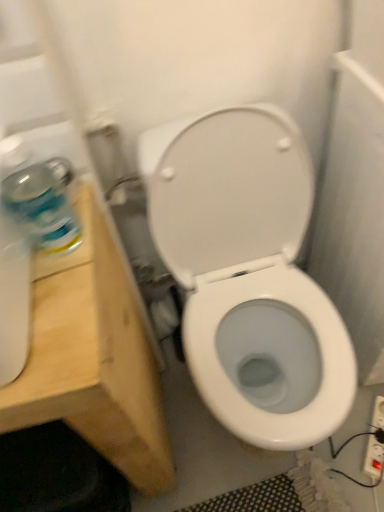
What do you see at coordinates (93, 358) in the screenshot? I see `light wood vanity at left` at bounding box center [93, 358].

The width and height of the screenshot is (384, 512). Identify the location of light wood vanity at left. (93, 358).

What do you see at coordinates (374, 458) in the screenshot? I see `white plastic electrical outlet at lower right` at bounding box center [374, 458].

Locate an element on the screen. This screenshot has width=384, height=512. light wood vanity at left is located at coordinates (93, 358).

Is light wood vanity at left positioned beyond the bounds of white plastic electrical outlet at lower right?

That's correct, light wood vanity at left is outside of white plastic electrical outlet at lower right.

Does light wood vanity at left have a lesser height compared to white plastic electrical outlet at lower right?

Incorrect, the height of light wood vanity at left does not fall short of that of white plastic electrical outlet at lower right.

From a real-world perspective, which is physically below, light wood vanity at left or white plastic electrical outlet at lower right?

From a 3D spatial view, white plastic electrical outlet at lower right is below.

Would you consider light wood vanity at left to be distant from white plastic electrical outlet at lower right?

light wood vanity at left is near white plastic electrical outlet at lower right, not far away.

Would you consider white plastic electrical outlet at lower right to be distant from clear plastic bottle at left?

No, there isn't a large distance between white plastic electrical outlet at lower right and clear plastic bottle at left.

Does point (378, 446) come farther from viewer compared to point (5, 184)?

That is True.

Looking at this image, is white plastic electrical outlet at lower right looking in the opposite direction of clear plastic bottle at left?

white plastic electrical outlet at lower right does not have its back to clear plastic bottle at left.

From a real-world perspective, which object rests below the other?

white plastic electrical outlet at lower right.

Is there a large distance between clear plastic bottle at left and light wood vanity at left?

No, there isn't a large distance between clear plastic bottle at left and light wood vanity at left.

From a real-world perspective, is clear plastic bottle at left above or below light wood vanity at left?

clear plastic bottle at left is above light wood vanity at left.

The width and height of the screenshot is (384, 512). In the image, there is a clear plastic bottle at left. Find the location of `vanity below it (from a real-world perspective)`. vanity below it (from a real-world perspective) is located at coordinates (93, 358).

Who is smaller, light wood vanity at left or clear plastic bottle at left?

Smaller between the two is clear plastic bottle at left.

Can you confirm if light wood vanity at left is positioned to the right of clear plastic bottle at left?

No.

Is light wood vanity at left facing away from clear plastic bottle at left?

No, light wood vanity at left's orientation is not away from clear plastic bottle at left.

Is clear plastic bottle at left located within white glossy toilet at center?

Actually, clear plastic bottle at left is outside white glossy toilet at center.

At what (x,y) coordinates should I click in order to perform the action: click on toilet behind the clear plastic bottle at left. Please return your answer as a coordinate pair (x, y). The image size is (384, 512). Looking at the image, I should click on (246, 261).

How many degrees apart are the facing directions of white glossy toilet at center and clear plastic bottle at left?

The facing directions of white glossy toilet at center and clear plastic bottle at left are 3.16 degrees apart.

From a real-world perspective, who is located higher, white glossy toilet at center or clear plastic bottle at left?

clear plastic bottle at left is physically above.

Is clear plastic bottle at left oriented towards white glossy toilet at center?

No, clear plastic bottle at left is not oriented towards white glossy toilet at center.

Which of these two, clear plastic bottle at left or white glossy toilet at center, is smaller?

clear plastic bottle at left.

Looking at their sizes, would you say clear plastic bottle at left is wider or thinner than white glossy toilet at center?

Clearly, clear plastic bottle at left has less width compared to white glossy toilet at center.

Which is farther, (59, 234) or (193, 304)?

The point (193, 304) is farther.

Is white glossy toilet at center not near white plastic electrical outlet at lower right?

They are positioned close to each other.

Between white glossy toilet at center and white plastic electrical outlet at lower right, which one has smaller size?

white plastic electrical outlet at lower right.

Is white glossy toilet at center oriented away from white plastic electrical outlet at lower right?

No, white glossy toilet at center's orientation is not away from white plastic electrical outlet at lower right.

At what (x,y) coordinates should I click in order to perform the action: click on electric outlet below the light wood vanity at left (from the image's perspective). Please return your answer as a coordinate pair (x, y). The image size is (384, 512). Looking at the image, I should click on (374, 458).

Find the location of a particular element. The width and height of the screenshot is (384, 512). electric outlet behind the clear plastic bottle at left is located at coordinates (374, 458).

When comparing their distances from clear plastic bottle at left, does white glossy toilet at center or white plastic electrical outlet at lower right seem closer?

Among the two, white glossy toilet at center is located nearer to clear plastic bottle at left.

From the picture: Estimate the real-world distances between objects in this image. Which object is closer to light wood vanity at left, white glossy toilet at center or clear plastic bottle at left?

clear plastic bottle at left is positioned closer to the anchor light wood vanity at left.

Looking at the image, which one is located further to white plastic electrical outlet at lower right, light wood vanity at left or white glossy toilet at center?

light wood vanity at left is further to white plastic electrical outlet at lower right.

In the scene shown: Considering their positions, is white glossy toilet at center positioned closer to white plastic electrical outlet at lower right than light wood vanity at left?

white glossy toilet at center.

Based on their spatial positions, is white glossy toilet at center or clear plastic bottle at left further from white plastic electrical outlet at lower right?

clear plastic bottle at left.

Looking at the image, which one is located closer to white plastic electrical outlet at lower right, clear plastic bottle at left or light wood vanity at left?

light wood vanity at left lies closer to white plastic electrical outlet at lower right than the other object.

Which object lies further to the anchor point white plastic electrical outlet at lower right, clear plastic bottle at left or white glossy toilet at center?

Based on the image, clear plastic bottle at left appears to be further to white plastic electrical outlet at lower right.

When comparing their distances from clear plastic bottle at left, does white plastic electrical outlet at lower right or light wood vanity at left seem further?

white plastic electrical outlet at lower right.

The width and height of the screenshot is (384, 512). Identify the location of toilet located between light wood vanity at left and white plastic electrical outlet at lower right in the left-right direction. (246, 261).

This screenshot has width=384, height=512. I want to click on cleaning product between light wood vanity at left and white plastic electrical outlet at lower right, so click(42, 207).

Locate an element on the screen. toilet between clear plastic bottle at left and white plastic electrical outlet at lower right is located at coordinates (246, 261).

Locate an element on the screen. This screenshot has width=384, height=512. cleaning product between light wood vanity at left and white glossy toilet at center from left to right is located at coordinates (42, 207).